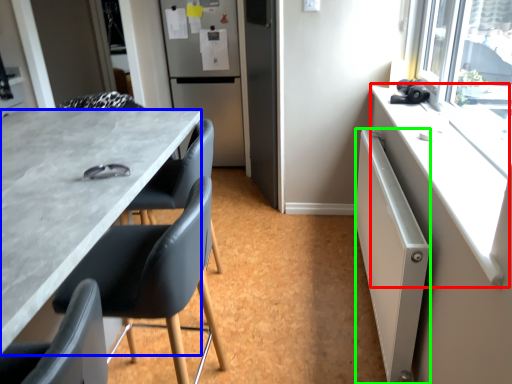
Question: Which object is the closest to the counter top (highlighted by a red box)? Choose among these: desk (highlighted by a blue box) or radiator (highlighted by a green box).

Choices:
 (A) desk
 (B) radiator

Answer: (B)